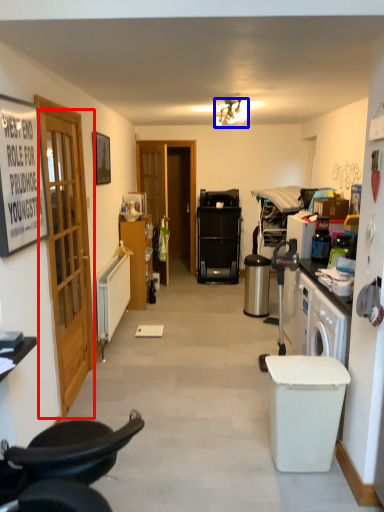
Question: Which of the following is the closest to the observer, door (highlighted by a red box) or lamp (highlighted by a blue box)?

Choices:
 (A) door
 (B) lamp

Answer: (A)